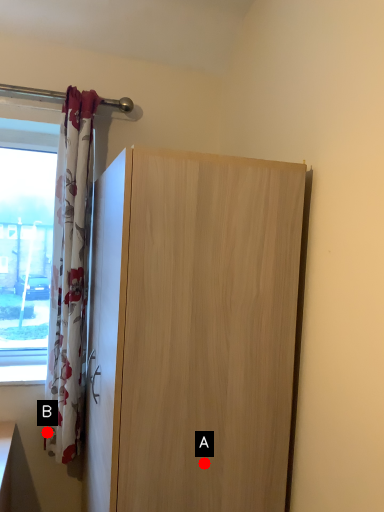
Question: Two points are circled on the image, labeled by A and B beside each circle. Which point is further to the camera?

Choices:
 (A) A is further
 (B) B is further

Answer: (B)